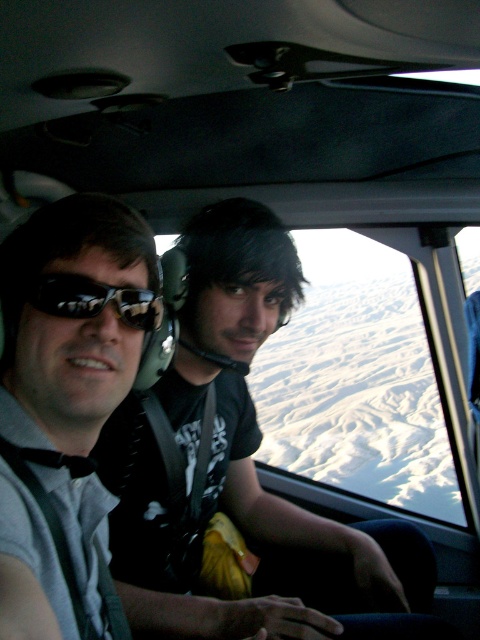
You are a passenger in the cockpit and need to locate the matte black helmet at center. Based on the coordinates provided, is the helmet closer to the left or right side of the cockpit?

The matte black helmet at center is located at point 0.719 on the x axis, which indicates it is closer to the right side of the cockpit.

You are a passenger in the cockpit and want to place a small item between the matte black helmet at center and the matte black sunglasses at left. Is there enough space between them?

The matte black helmet at center is positioned under the matte black sunglasses at left, so there is vertical space between them. However, since the question asks about placing an item between them horizontally, there might not be enough space as they are aligned vertically.